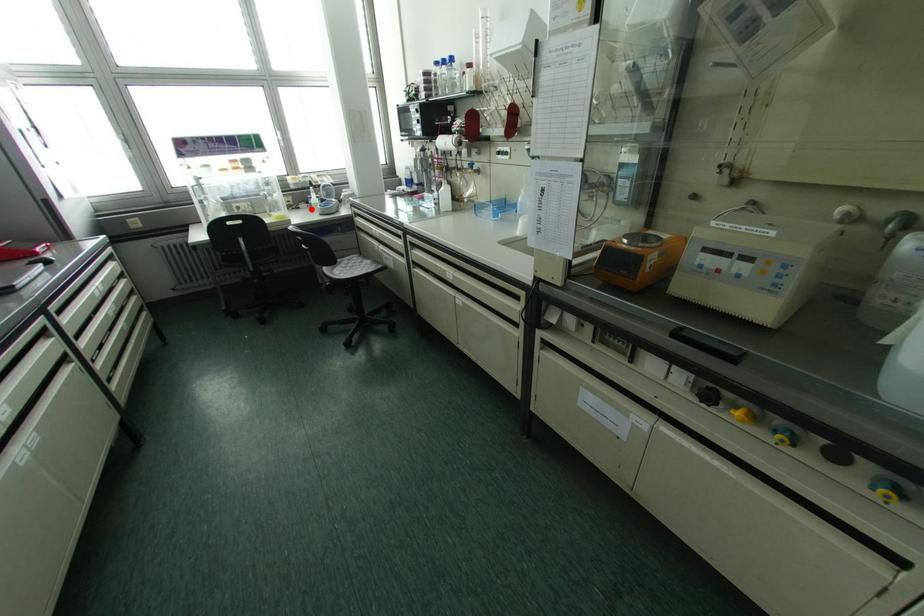
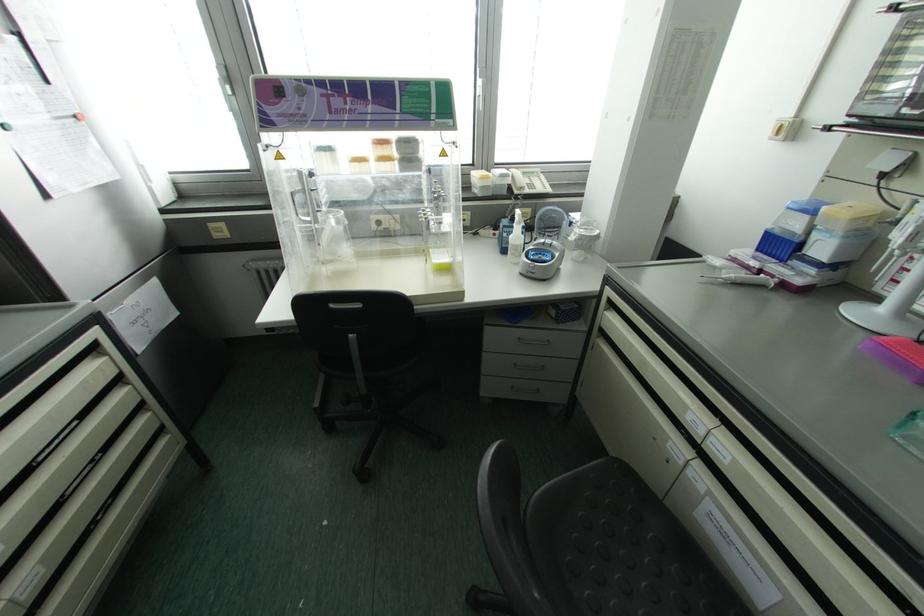
Question: I am providing you with two images of the same scene from different viewpoints. Image1 has a red point marked. In image2, the corresponding 3D location appears at what relative position? Reply with the corresponding letter.

Choices:
 (A) Closer
 (B) Farther

Answer: (B)